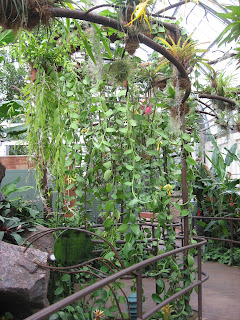
This screenshot has width=240, height=320. What are the coordinates of `windows to outdoors` in the screenshot? It's located at (222, 141).